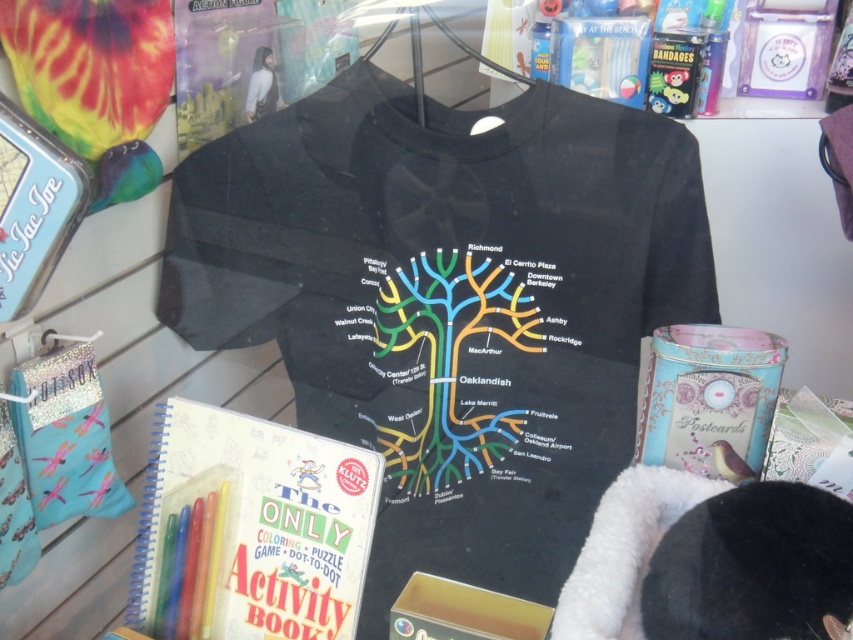
Can you confirm if matte paper activity book at center is shorter than multicolored map at center?

Indeed, matte paper activity book at center has a lesser height compared to multicolored map at center.

Does matte paper activity book at center lie in front of multicolored map at center?

Yes.

What do you see at coordinates (251, 529) in the screenshot? The image size is (853, 640). I see `matte paper activity book at center` at bounding box center [251, 529].

Find the location of a particular element. The height and width of the screenshot is (640, 853). matte paper activity book at center is located at coordinates (251, 529).

Is matte paper activity book at center smaller than gold cardboard box at lower center?

No, matte paper activity book at center is not smaller than gold cardboard box at lower center.

Is point (276, 531) positioned behind point (456, 628)?

Yes, it is behind point (456, 628).

Identify the location of matte paper activity book at center. This screenshot has width=853, height=640. (251, 529).

Who is shorter, multicolored map at center or gold cardboard box at lower center?

gold cardboard box at lower center is shorter.

Identify the location of multicolored map at center. (451, 362).